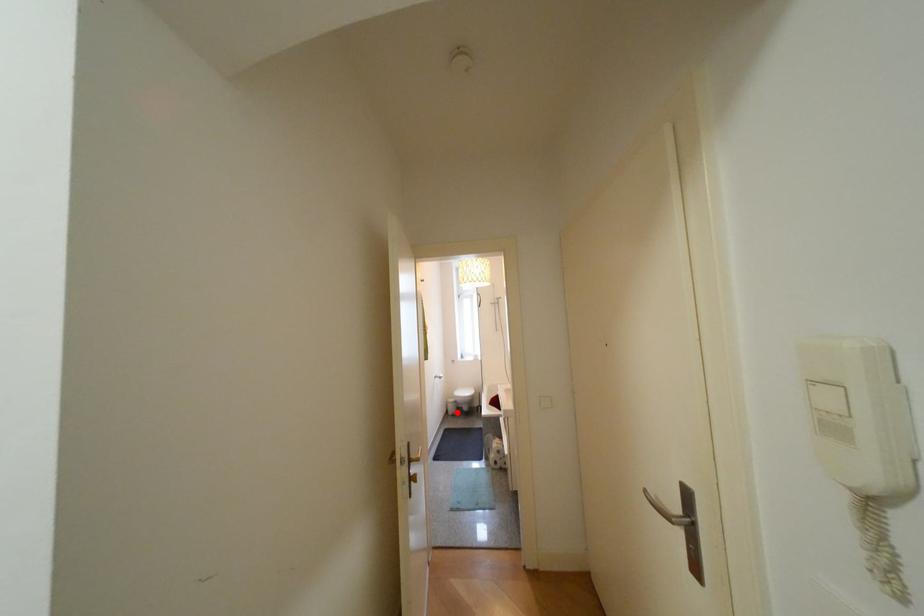
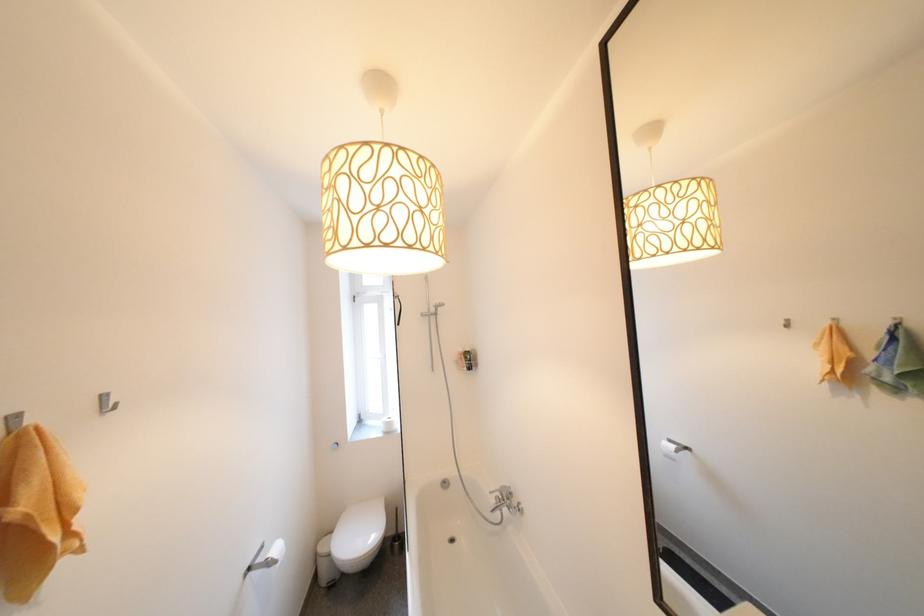
Question: I am providing you with two images of the same scene from different viewpoints. A red point is marked on the first image. Is the red point's position out of view in image 2?

Choices:
 (A) Yes
 (B) No

Answer: (B)